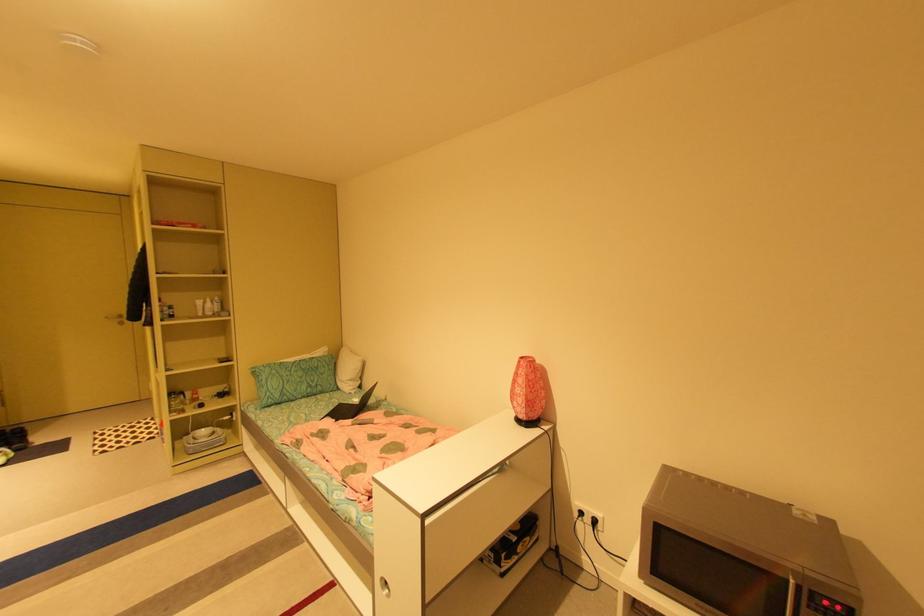
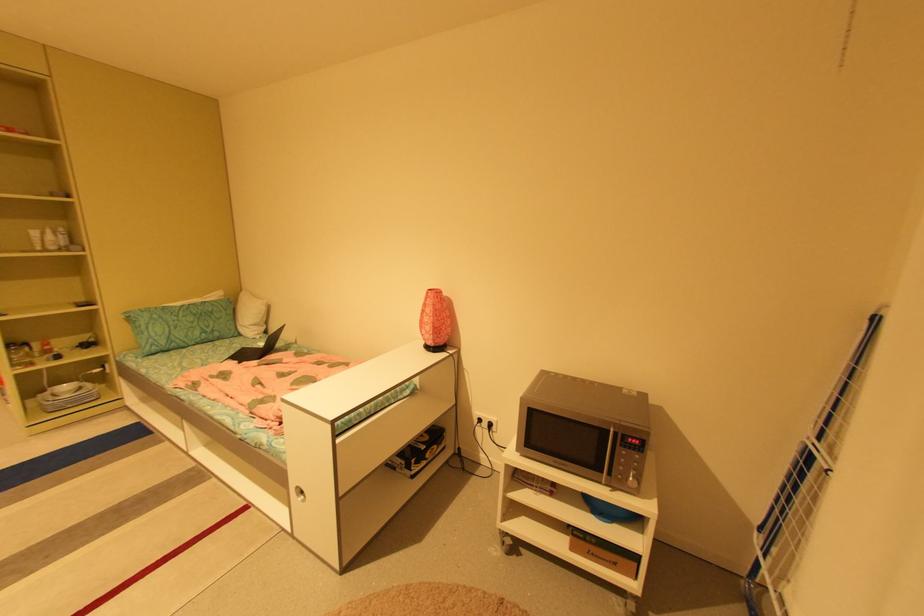
In a continuous first-person perspective shot, in which direction is the camera moving?

The cameraman walked toward right, backward.